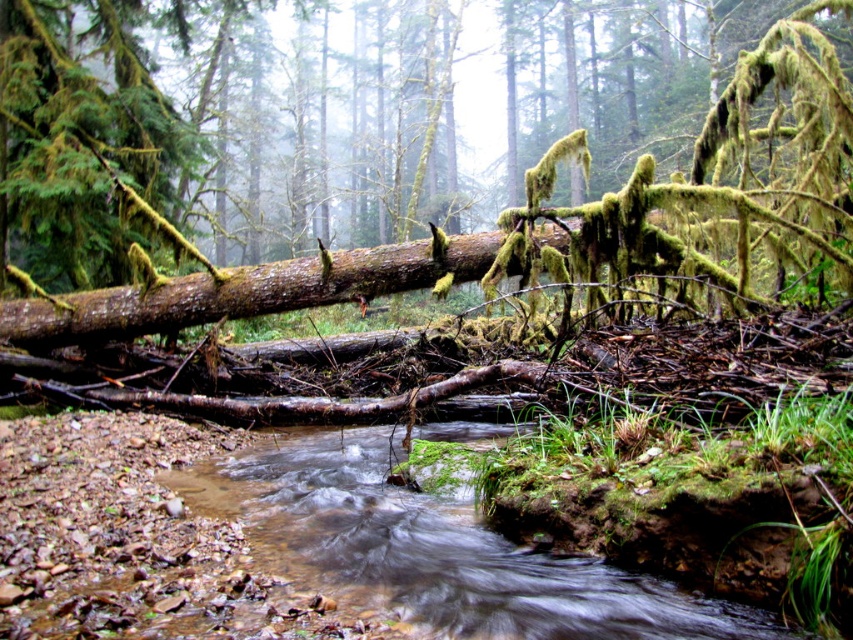
Question: Observing the image, what is the correct spatial positioning of brown mossy log at center in reference to moss-covered wood at center?

Choices:
 (A) left
 (B) right

Answer: (B)

Question: Among these points, which one is nearest to the camera?

Choices:
 (A) (398, 289)
 (B) (456, 209)
 (C) (383, 456)

Answer: (C)

Question: Can you confirm if brown mossy log at center is positioned above moss-covered wood at center?

Choices:
 (A) yes
 (B) no

Answer: (A)

Question: Which object appears farthest from the camera in this image?

Choices:
 (A) brown mossy log at center
 (B) moss-covered wood at center
 (C) clear water at center

Answer: (A)

Question: Which object is the farthest from the moss-covered wood at center?

Choices:
 (A) clear water at center
 (B) brown mossy log at center

Answer: (B)

Question: Does clear water at center appear over moss-covered wood at center?

Choices:
 (A) yes
 (B) no

Answer: (B)